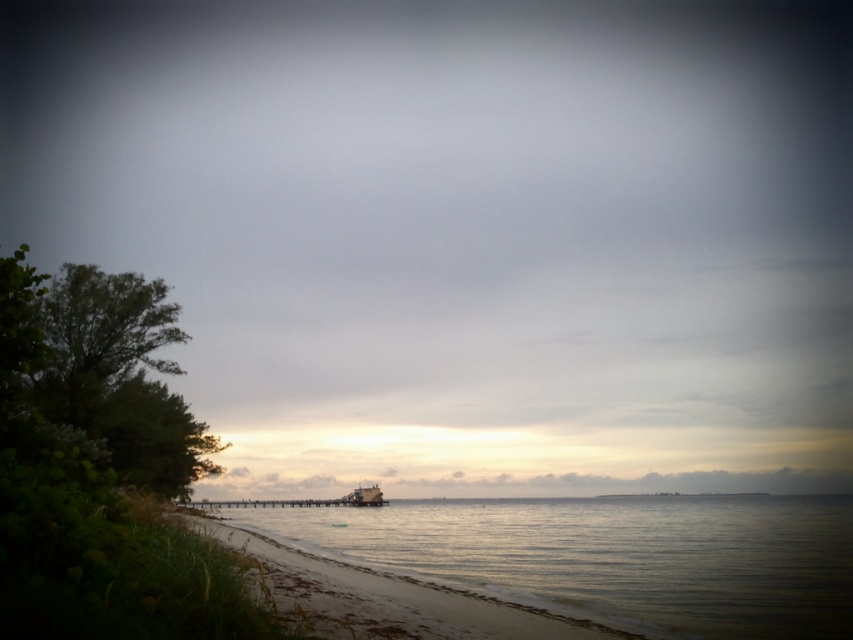
Question: Is clear water at lower left below metallic gray boat at center?

Choices:
 (A) no
 (B) yes

Answer: (A)

Question: Among these objects, which one is farthest from the camera?

Choices:
 (A) metallic gray boat at center
 (B) clear water at lower left

Answer: (A)

Question: Can you confirm if clear water at lower left is positioned to the right of metallic gray boat at center?

Choices:
 (A) no
 (B) yes

Answer: (B)

Question: Which point is farther from the camera taking this photo?

Choices:
 (A) (352, 490)
 (B) (842, 540)

Answer: (A)

Question: Can you confirm if clear water at lower left is positioned to the left of metallic gray boat at center?

Choices:
 (A) yes
 (B) no

Answer: (B)

Question: Which point appears closest to the camera in this image?

Choices:
 (A) (375, 499)
 (B) (647, 612)

Answer: (B)